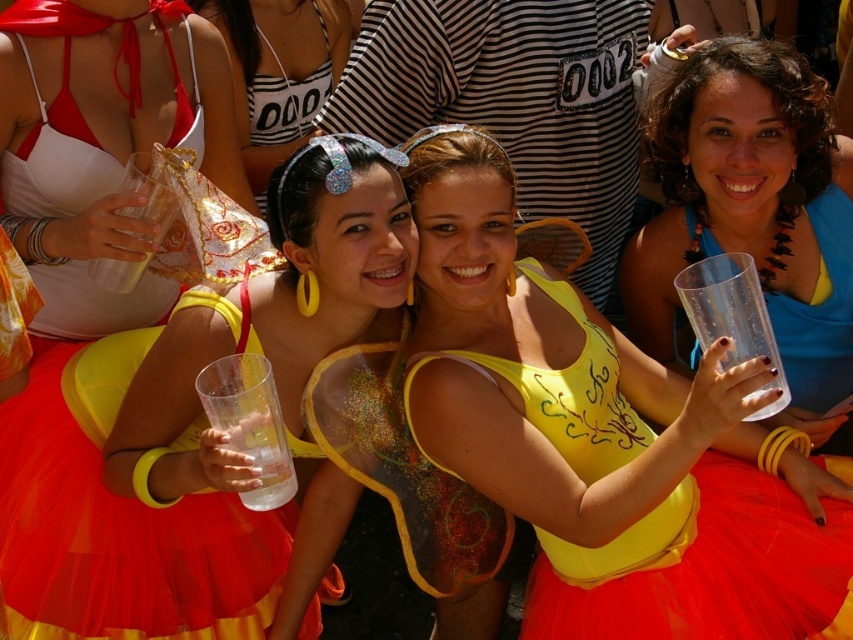
Can you confirm if transparent plastic cup at upper right is taller than matte plastic cup at upper center?

Yes, transparent plastic cup at upper right is taller than matte plastic cup at upper center.

How far apart are transparent plastic cup at upper right and matte plastic cup at upper center?

The distance of transparent plastic cup at upper right from matte plastic cup at upper center is 6.46 feet.

The height and width of the screenshot is (640, 853). I want to click on transparent plastic cup at upper right, so click(x=752, y=212).

Find the location of `transparent plastic cup at upper right`. transparent plastic cup at upper right is located at coordinates (752, 212).

Is translucent plastic cup at center to the left of matte plastic cup at upper center from the viewer's perspective?

In fact, translucent plastic cup at center is to the right of matte plastic cup at upper center.

Looking at this image, can you confirm if translucent plastic cup at center is shorter than matte plastic cup at upper center?

No, translucent plastic cup at center is not shorter than matte plastic cup at upper center.

Locate an element on the screen. translucent plastic cup at center is located at coordinates (605, 440).

Identify the location of translucent plastic cup at center. This screenshot has height=640, width=853. (605, 440).

Who is shorter, white satin bikini top at upper left or matte plastic cup at upper center?

Standing shorter between the two is matte plastic cup at upper center.

Is white satin bikini top at upper left wider than matte plastic cup at upper center?

In fact, white satin bikini top at upper left might be narrower than matte plastic cup at upper center.

Locate an element on the screen. This screenshot has height=640, width=853. white satin bikini top at upper left is located at coordinates (102, 141).